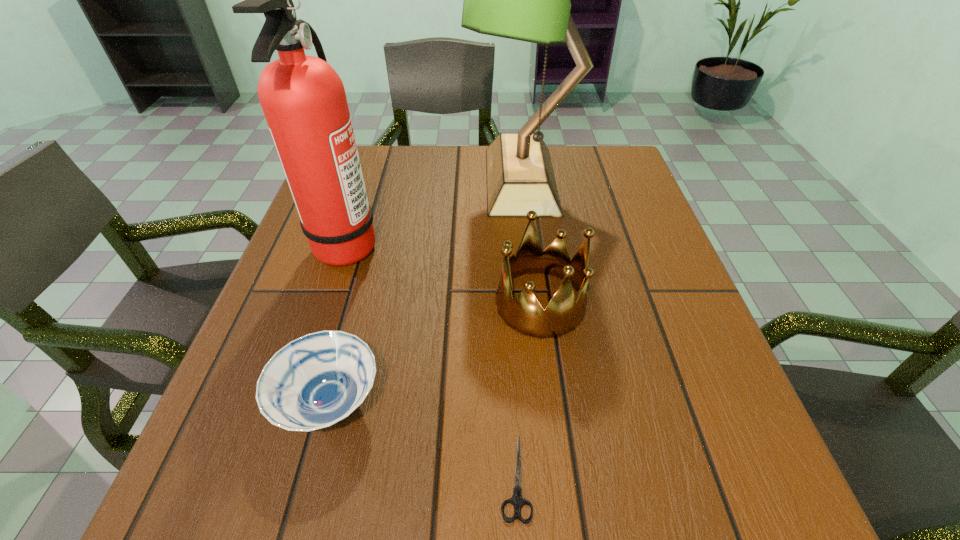
Where is `table lamp`? The height and width of the screenshot is (540, 960). table lamp is located at coordinates (528, 0).

What are the coordinates of `fire extinguisher` in the screenshot? It's located at (303, 99).

Where is `crown`? crown is located at coordinates (524, 313).

This screenshot has height=540, width=960. What are the coordinates of `soup bowl` in the screenshot? It's located at (315, 381).

I want to click on the shortest object, so click(x=517, y=500).

Find the location of a particular element. free space located 0.170m on the metallic stand of the table lamp is located at coordinates point(400,180).

Locate an element on the screen. This screenshot has width=960, height=540. vacant point located 0.340m on the metallic stand of the table lamp is located at coordinates (332, 180).

Locate an element on the screen. This screenshot has height=540, width=960. free spot located on the metallic stand of the table lamp is located at coordinates (376, 180).

Image resolution: width=960 pixels, height=540 pixels. What are the coordinates of `vacant area situated 0.240m on the handle side of the fire extinguisher` in the screenshot? It's located at (492, 244).

Locate an element on the screen. This screenshot has width=960, height=540. vacant region located 0.110m on the right of the third shortest object is located at coordinates (644, 303).